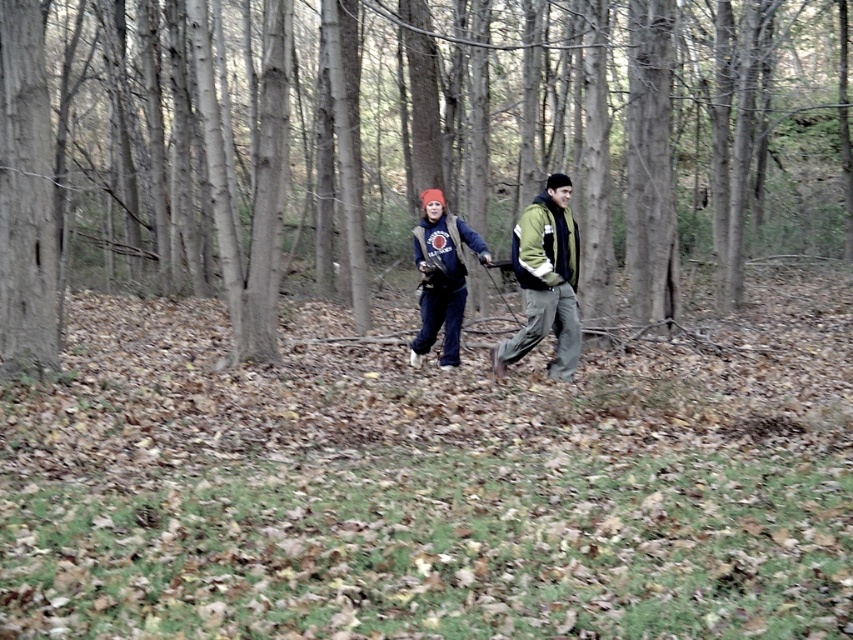
Who is more forward, (260, 173) or (456, 225)?

Point (260, 173)

Is brown bark tree at center thinner than matte blue jacket at center?

Incorrect, brown bark tree at center's width is not less than matte blue jacket at center's.

Who is more forward, (148, 3) or (430, 342)?

Positioned in front is point (430, 342).

Find the location of a particular element. The image size is (853, 640). brown bark tree at center is located at coordinates (416, 150).

Can you confirm if brown bark tree at center is shorter than matte blue sweatshirt at center?

In fact, brown bark tree at center may be taller than matte blue sweatshirt at center.

Does point (822, 106) come in front of point (434, 189)?

No, it is behind (434, 189).

What are the coordinates of `brown bark tree at center` in the screenshot? It's located at click(x=416, y=150).

Does matte blue jacket at center have a lesser width compared to matte blue sweatshirt at center?

In fact, matte blue jacket at center might be wider than matte blue sweatshirt at center.

Is matte blue jacket at center wider than matte blue sweatshirt at center?

Yes, matte blue jacket at center is wider than matte blue sweatshirt at center.

Is point (566, 368) more distant than point (413, 243)?

That is False.

You are a GUI agent. You are given a task and a screenshot of the screen. Output one action in this format:
    pyautogui.click(x=<x>, y=<y>)
    Task: Click on the matte blue jacket at center
    The height and width of the screenshot is (640, 853).
    Given the screenshot: What is the action you would take?
    pyautogui.click(x=546, y=280)